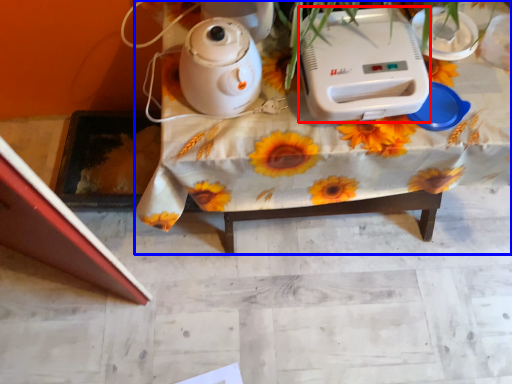
Question: Among these objects, which one is farthest to the camera, appliance (highlighted by a red box) or table (highlighted by a blue box)?

Choices:
 (A) appliance
 (B) table

Answer: (B)